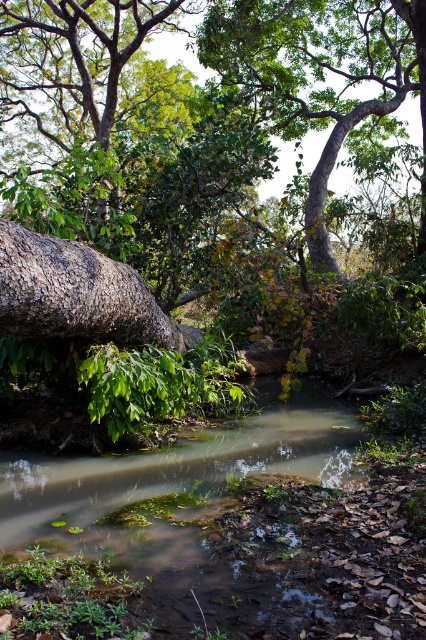
You are a bird looking for a nesting spot. You see the green leafy tree at upper left and the green rough bark tree at upper center. Which tree would you choose if you want to build a nest higher up?

The green leafy tree at upper left is taller than the green rough bark tree at upper center, so you should choose the green leafy tree at upper left to build a nest higher up.

You are standing at the edge of the stream and want to cross to the other side. The green mossy river at center is in your path. Can you step over it?

The green mossy river at center is located at point (206, 536), which suggests it is centrally positioned in the image. Since the stream is described as meandering and surrounded by vegetation, it might be too wide or deep to step over safely. However, the exact dimensions aren not provided, so it is uncertain. Consider using the fallen tree trunk on the left for a safer crossing.